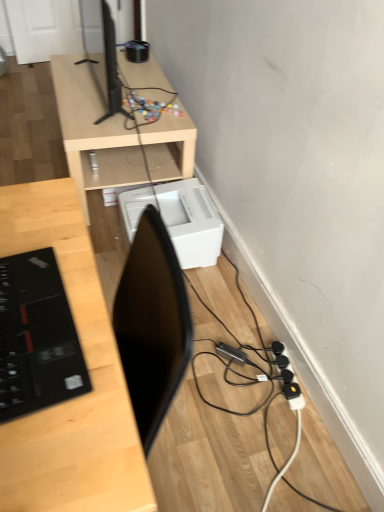
Question: From the image's perspective, is white plastic printer at lower center located beneath black plastic extension cord at lower right?

Choices:
 (A) yes
 (B) no

Answer: (B)

Question: Is white plastic printer at lower center placed right next to black plastic extension cord at lower right?

Choices:
 (A) yes
 (B) no

Answer: (B)

Question: Is white plastic printer at lower center positioned before black plastic extension cord at lower right?

Choices:
 (A) yes
 (B) no

Answer: (B)

Question: Is black plastic extension cord at lower right at the back of white plastic printer at lower center?

Choices:
 (A) no
 (B) yes

Answer: (A)

Question: Does white plastic printer at lower center come behind black plastic extension cord at lower right?

Choices:
 (A) no
 (B) yes

Answer: (B)

Question: From the image's perspective, is white plastic printer at lower center above or below light wood/finished desk at upper center, marked as the first desk in a back-to-front arrangement?

Choices:
 (A) above
 (B) below

Answer: (B)

Question: Is white plastic printer at lower center inside or outside of light wood/finished desk at upper center, which appears as the 2th desk when ordered from the bottom?

Choices:
 (A) outside
 (B) inside

Answer: (A)

Question: Is white plastic printer at lower center in front of or behind light wood/finished desk at upper center, the 1th desk from the top, in the image?

Choices:
 (A) front
 (B) behind

Answer: (A)

Question: From a real-world perspective, is white plastic printer at lower center positioned above or below light wood/finished desk at upper center, positioned as the second desk in front-to-back order?

Choices:
 (A) above
 (B) below

Answer: (B)

Question: Is black plastic extension cord at lower right in front of or behind black glossy laptop at left in the image?

Choices:
 (A) behind
 (B) front

Answer: (A)

Question: In terms of width, does black plastic extension cord at lower right look wider or thinner when compared to black glossy laptop at left?

Choices:
 (A) wide
 (B) thin

Answer: (B)

Question: In terms of size, does black plastic extension cord at lower right appear bigger or smaller than black glossy laptop at left?

Choices:
 (A) small
 (B) big

Answer: (A)

Question: Is black plastic extension cord at lower right inside or outside of black glossy laptop at left?

Choices:
 (A) inside
 (B) outside

Answer: (B)

Question: Based on their sizes in the image, would you say light wood desk at center, arranged as the 1th desk when viewed from the front, is bigger or smaller than black glossy laptop at left?

Choices:
 (A) big
 (B) small

Answer: (A)

Question: From the image's perspective, is light wood desk at center, which is the second desk in back-to-front order, positioned above or below black glossy laptop at left?

Choices:
 (A) below
 (B) above

Answer: (A)